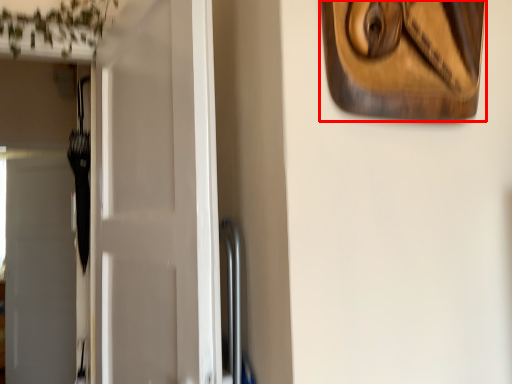
Question: Considering the relative positions of picture frame (annotated by the red box) and door in the image provided, where is picture frame (annotated by the red box) located with respect to the staircase?

Choices:
 (A) right
 (B) left

Answer: (A)